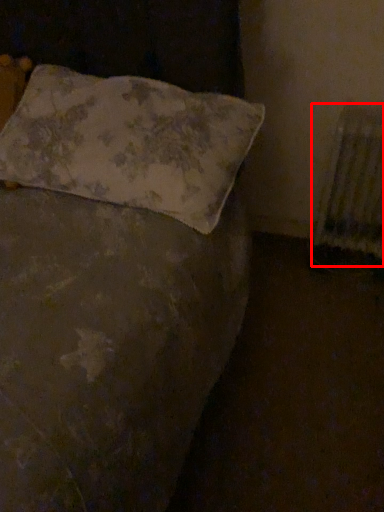
Question: Considering the relative positions of radiator (annotated by the red box) and pillow in the image provided, where is radiator (annotated by the red box) located with respect to the staircase?

Choices:
 (A) right
 (B) left

Answer: (A)